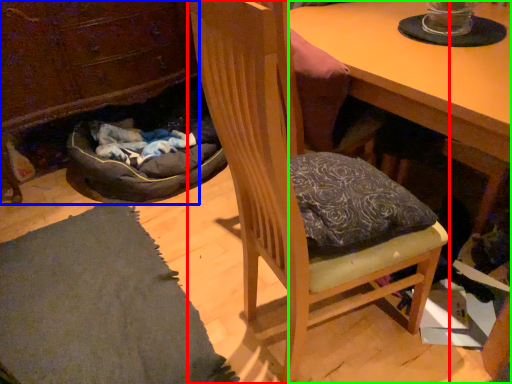
Question: Based on their relative distances, which object is farther from chair (highlighted by a red box)? Choose from cabinetry (highlighted by a blue box) and desk (highlighted by a green box).

Choices:
 (A) cabinetry
 (B) desk

Answer: (A)